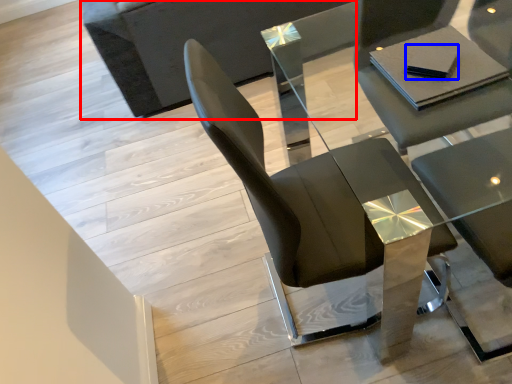
Question: Which of the following is the closest to the observer, couch (highlighted by a red box) or pad (highlighted by a blue box)?

Choices:
 (A) couch
 (B) pad

Answer: (B)